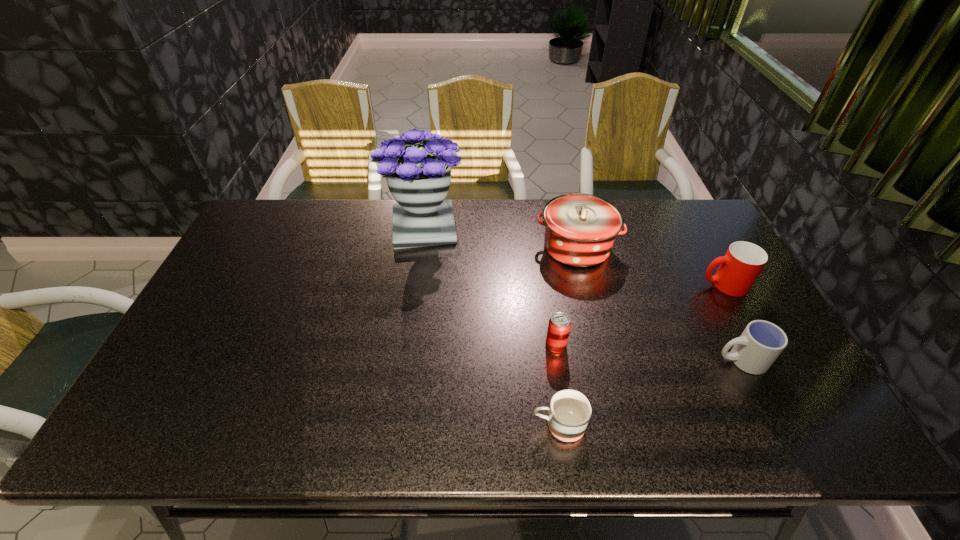
The height and width of the screenshot is (540, 960). Find the location of `free space located on the side with the handle of the shortest object`. free space located on the side with the handle of the shortest object is located at coordinates (418, 426).

The height and width of the screenshot is (540, 960). Find the location of `bouquet that is at the far edge`. bouquet that is at the far edge is located at coordinates (418, 176).

Where is `casserole located at the far edge`? The height and width of the screenshot is (540, 960). casserole located at the far edge is located at coordinates (580, 229).

Locate an element on the screen. The image size is (960, 540). object that is at the near edge is located at coordinates (570, 411).

In the image, there is a desktop. Identify the location of vacant space at the far edge. (541, 231).

In the image, there is a desktop. Find the location of `vacant space at the left edge`. vacant space at the left edge is located at coordinates (271, 243).

The height and width of the screenshot is (540, 960). In the image, there is a desktop. What are the coordinates of `free space at the right edge` in the screenshot? It's located at (723, 330).

In the image, there is a desktop. Identify the location of vacant space at the far left corner. The height and width of the screenshot is (540, 960). (271, 238).

In the image, there is a desktop. What are the coordinates of `vacant space at the near left corner` in the screenshot? It's located at (176, 422).

You are a GUI agent. You are given a task and a screenshot of the screen. Output one action in this format:
    pyautogui.click(x=<x>, y=<y>)
    Task: Click on the vacant space at the far right corner of the desktop
    
    Given the screenshot: What is the action you would take?
    pyautogui.click(x=676, y=215)